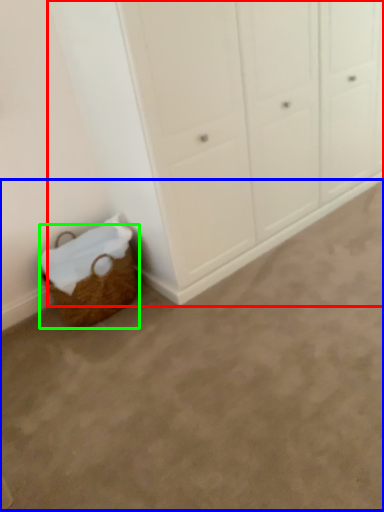
Question: Which object is positioned farthest from cupboard (highlighted by a red box)? Select from plain (highlighted by a blue box) and basket (highlighted by a green box).

Choices:
 (A) plain
 (B) basket

Answer: (A)